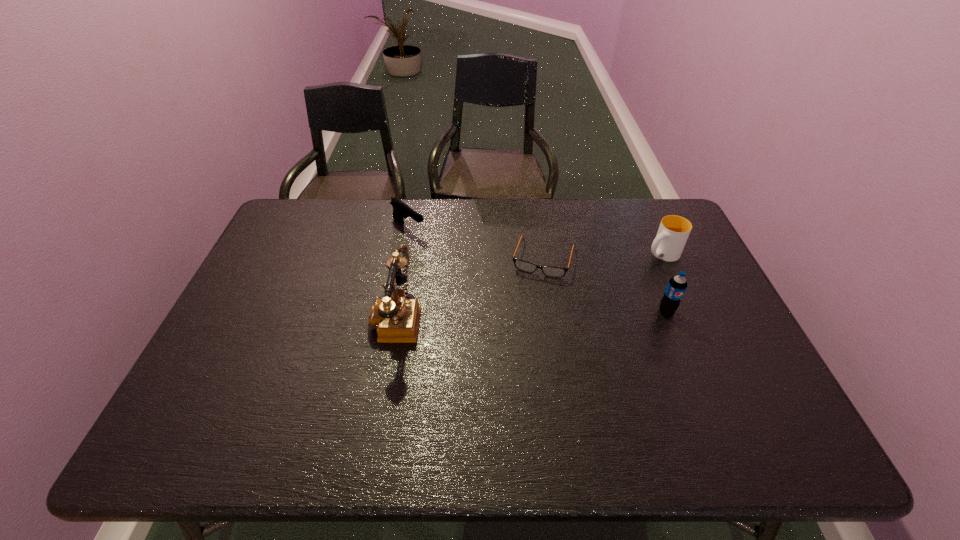
The width and height of the screenshot is (960, 540). In order to click on spectacles that is at the far edge in this screenshot , I will do [x=550, y=271].

Locate an element on the screen. The image size is (960, 540). soda bottle at the right edge is located at coordinates (677, 285).

Find the location of `cup present at the right edge`. cup present at the right edge is located at coordinates (673, 232).

Image resolution: width=960 pixels, height=540 pixels. What are the coordinates of `vacant space at the far edge of the desktop` in the screenshot? It's located at (529, 205).

Locate an element on the screen. free region at the near edge of the desktop is located at coordinates (691, 390).

Locate an element on the screen. Image resolution: width=960 pixels, height=540 pixels. free space at the left edge of the desktop is located at coordinates (278, 322).

I want to click on free space at the right edge of the desktop, so click(x=697, y=349).

Locate an element on the screen. vacant space at the far left corner of the desktop is located at coordinates (294, 198).

In the image, there is a desktop. Where is `free space at the near left corner`? free space at the near left corner is located at coordinates (234, 412).

The image size is (960, 540). I want to click on free space at the far right corner, so click(643, 219).